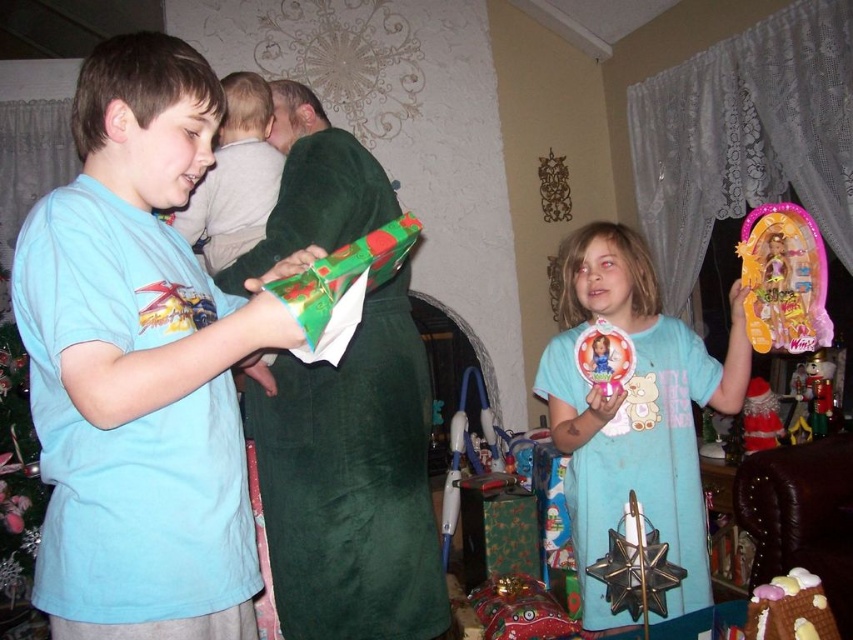
You are a guest at the holiday party and want to place a small gift under the matte green blanket at upper center. However, there is a satin red santa hat at upper right nearby. Which object should you avoid placing the gift near to ensure it stays under the blanket?

You should avoid placing the gift near the satin red santa hat at upper right because the matte green blanket at upper center is to the left of the satin red santa hat at upper right, so placing the gift near the hat would move it away from the blanket.

You are standing in the living room and want to take a photo of the point at coordinates (70, 570). If your camera has a minimum focus distance of 35 inches, will it be able to focus on that point?

The distance between the camera and the point at (70, 570) is 37.68 inches, which is beyond the camera minimum focus distance of 35 inches. Therefore, the camera cannot focus on that point.